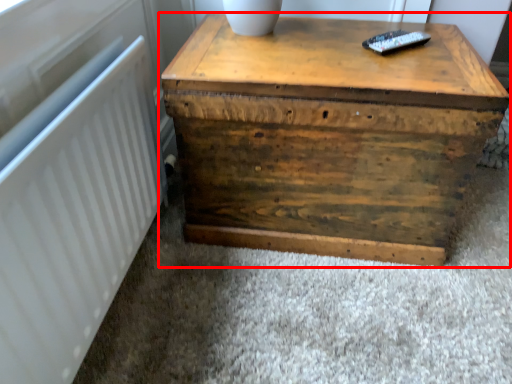
Question: In this image, where is table (annotated by the red box) located relative to radiator?

Choices:
 (A) left
 (B) right

Answer: (B)